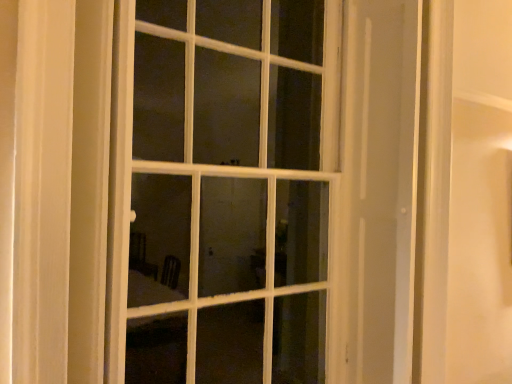
The width and height of the screenshot is (512, 384). Find the location of `white glass window at center`. white glass window at center is located at coordinates (230, 189).

What do you see at coordinates (230, 189) in the screenshot? I see `white glass window at center` at bounding box center [230, 189].

What are the coordinates of `white glass window at center` in the screenshot? It's located at (230, 189).